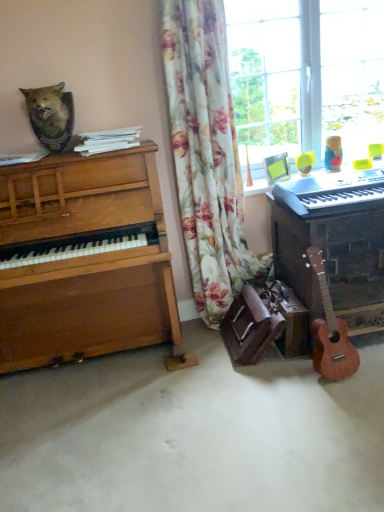
Question: Considering the positions of wooden piano at left, the first piano positioned from the left, and wooden piano at right, the 1th piano viewed from the right, in the image, is wooden piano at left, the first piano positioned from the left, taller or shorter than wooden piano at right, the 1th piano viewed from the right,?

Choices:
 (A) short
 (B) tall

Answer: (B)

Question: Is point (187, 362) positioned closer to the camera than point (319, 198)?

Choices:
 (A) closer
 (B) farther

Answer: (B)

Question: Which of these objects is positioned farthest from the rustic wooden plaque at upper left?

Choices:
 (A) wooden piano at left, the first piano positioned from the left
 (B) light brown wood guitar at lower right
 (C) white plastic keyboard at right
 (D) floral fabric curtain at center
 (E) wooden piano at right, the 1th piano viewed from the right

Answer: (B)

Question: Which of these objects is positioned closest to the white plastic keyboard at right?

Choices:
 (A) wooden piano at left, the 2th piano positioned from the right
 (B) wooden piano at right, the second piano from the left
 (C) rustic wooden plaque at upper left
 (D) light brown wood guitar at lower right
 (E) floral fabric curtain at center

Answer: (B)